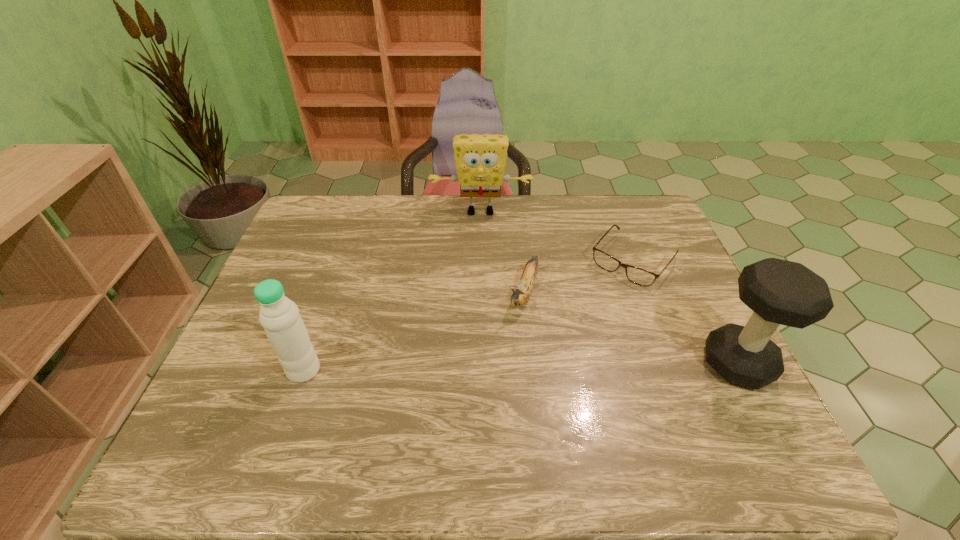
You are a GUI agent. You are given a task and a screenshot of the screen. Output one action in this format:
    pyautogui.click(x=<x>, y=<y>)
    Task: Click on the vacant space located 0.180m on the face of the farthest object
    
    Given the screenshot: What is the action you would take?
    pyautogui.click(x=480, y=257)

The height and width of the screenshot is (540, 960). What are the coordinates of `free space located on the face of the farthest object` in the screenshot? It's located at (480, 248).

The image size is (960, 540). What are the coordinates of `blank area located on the face of the farthest object` in the screenshot? It's located at (480, 255).

Where is `free space located 0.090m on the peel of the second shortest object`? free space located 0.090m on the peel of the second shortest object is located at coordinates (509, 342).

Image resolution: width=960 pixels, height=540 pixels. Identify the location of free space located 0.200m on the peel of the second shortest object. (493, 376).

Where is `free space located 0.280m on the peel of the second shortest object`? This screenshot has height=540, width=960. free space located 0.280m on the peel of the second shortest object is located at coordinates (482, 405).

Locate an element on the screen. spectacles at the far edge is located at coordinates (639, 276).

Locate an element on the screen. sponge at the far edge is located at coordinates (480, 160).

In order to click on object that is at the near edge in this screenshot , I will do `click(782, 292)`.

You are a GUI agent. You are given a task and a screenshot of the screen. Output one action in this format:
    pyautogui.click(x=<x>, y=<y>)
    Task: Click on the object located at the left edge
    
    Given the screenshot: What is the action you would take?
    pyautogui.click(x=279, y=316)